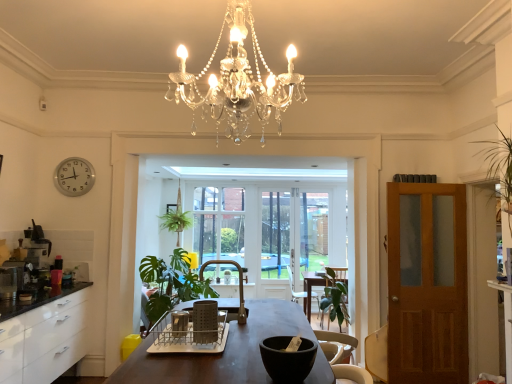
Question: Is black matte bowl at center inside or outside of clear glass window screen at center, the 2th window screen viewed from the left?

Choices:
 (A) outside
 (B) inside

Answer: (A)

Question: In terms of width, does black matte bowl at center look wider or thinner when compared to clear glass window screen at center, the 2th window screen viewed from the left?

Choices:
 (A) thin
 (B) wide

Answer: (B)

Question: Considering the real-world distances, which object is closest to the clear glass window screen at center, the 2th window screen viewed from the left?

Choices:
 (A) metallic black coffee machine at left
 (B) green fabric armchair at center, the second armchair when ordered from bottom to top
 (C) green fabric armchair at center, the 1th armchair in the back-to-front sequence
 (D) green leafy plant at center
 (E) black matte bowl at center

Answer: (B)

Question: Which object is positioned farthest from the green fabric armchair at center, which is the 1th armchair from right to left?

Choices:
 (A) green leafy plant at center
 (B) metallic silver coffee maker at left
 (C) clear glass window screen at center, the 2th window screen viewed from the left
 (D) dark brown wooden table at center
 (E) silver metallic clock at upper left

Answer: (B)